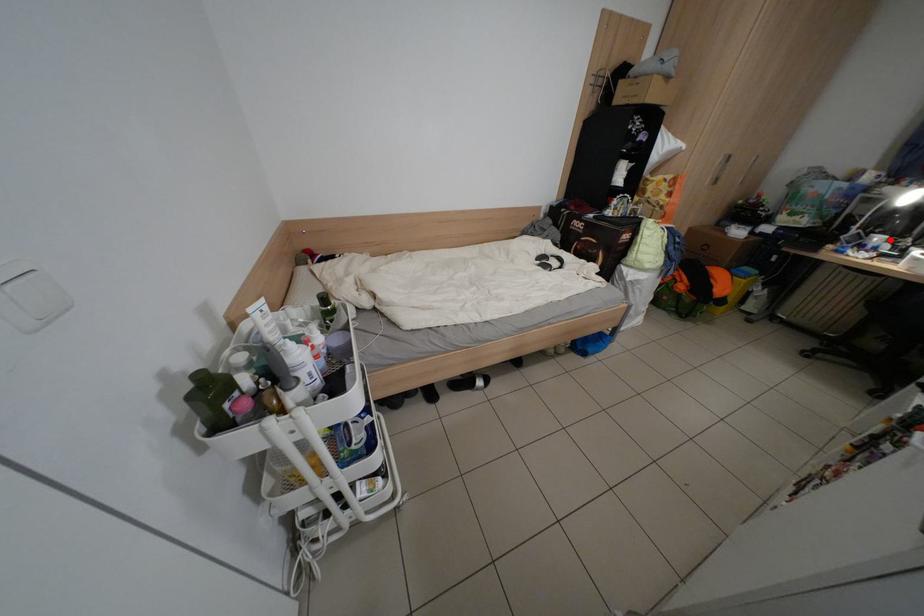
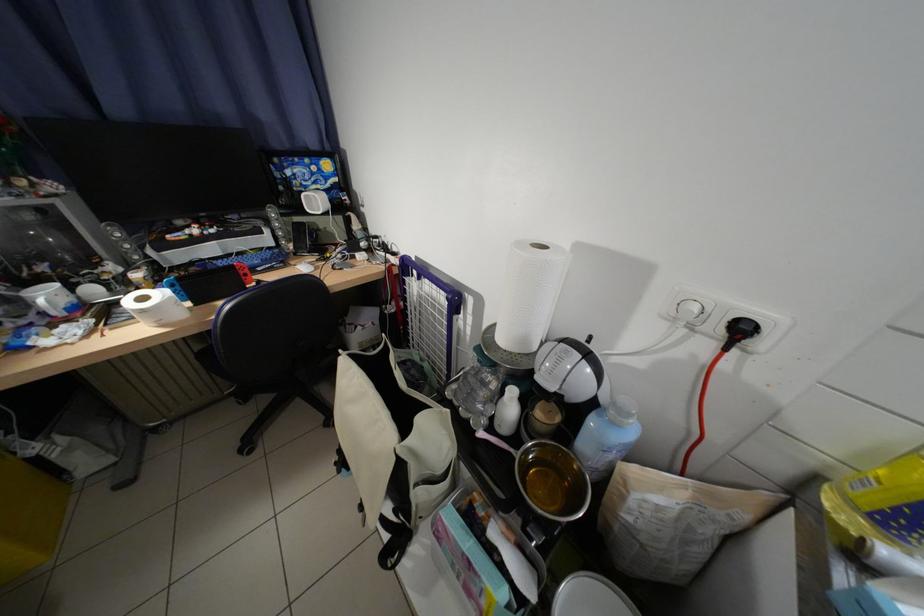
Question: A red point is marked in image1. In image2, is the corresponding 3D point closer to the camera or farther? Reply with the corresponding letter.

Choices:
 (A) The corresponding 3D point is closer.
 (B) The corresponding 3D point is farther.

Answer: (A)